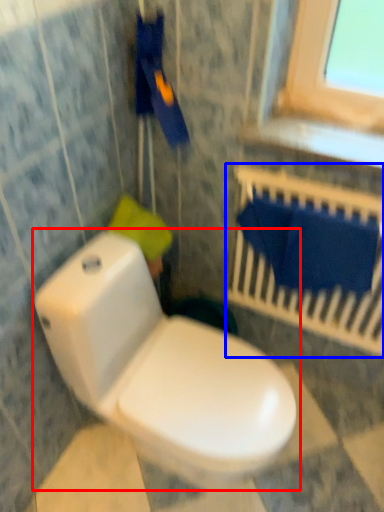
Question: Among these objects, which one is nearest to the camera, toilet (highlighted by a red box) or balustrade (highlighted by a blue box)?

Choices:
 (A) toilet
 (B) balustrade

Answer: (A)